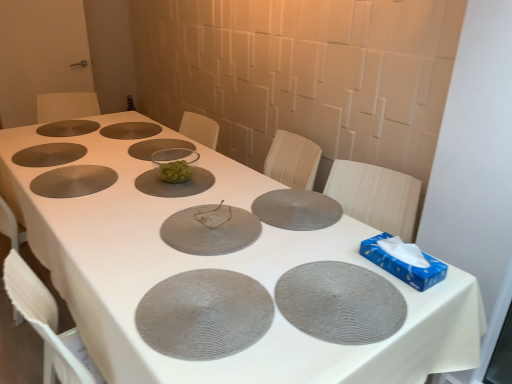
I want to click on free space that is in between matte gray plate at upper left, which is the 7th glass plate in front-to-back order, and matte gray glass plate at center, placed as the third glass plate when sorted from front to back, so click(x=110, y=183).